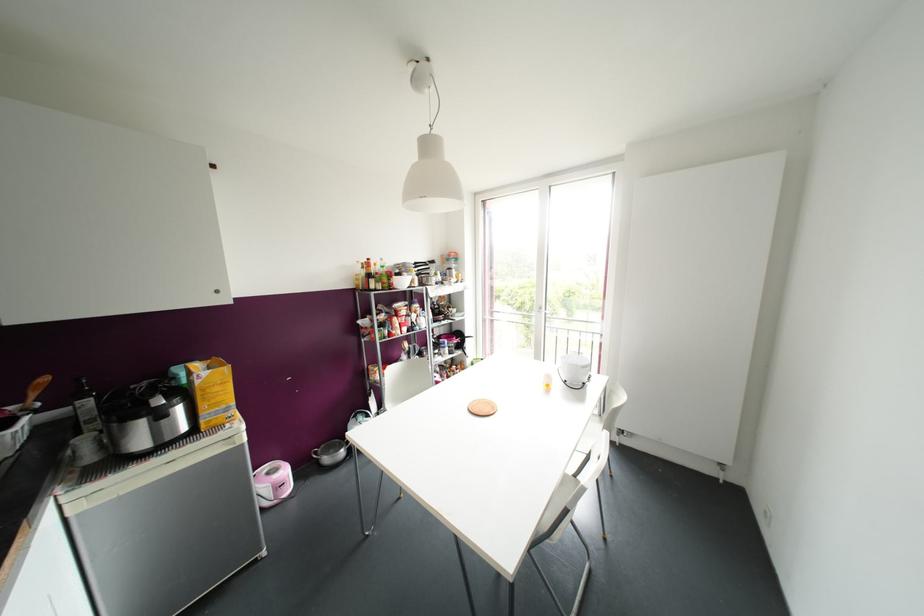
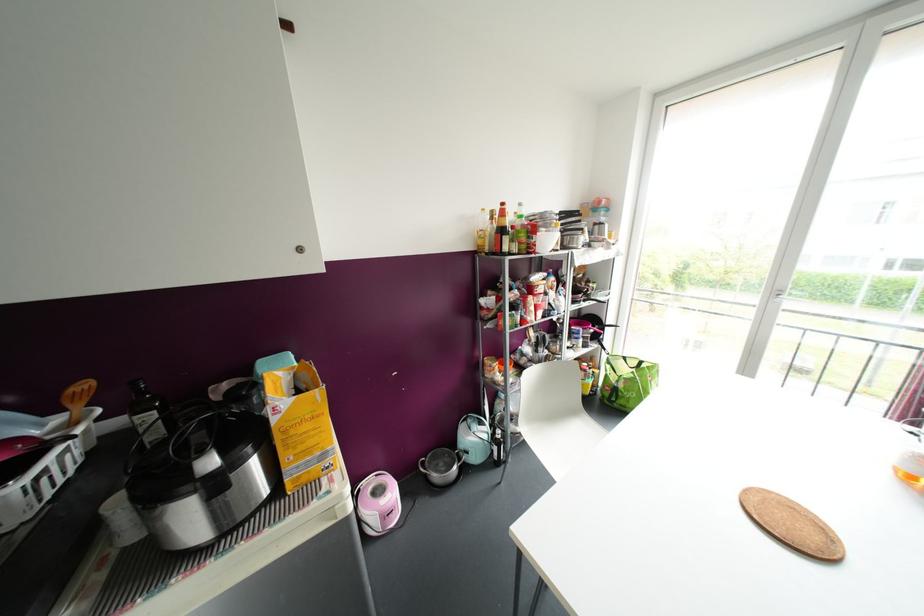
Where in the second image is the point corresponding to (368,259) from the first image?

(502, 204)